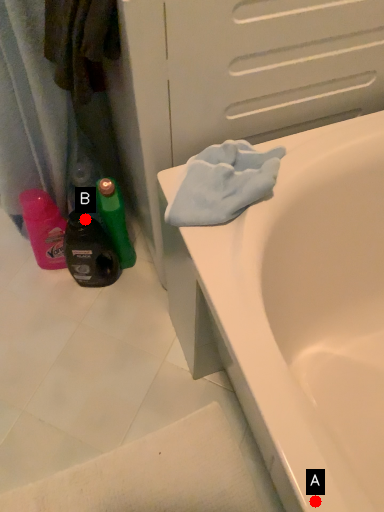
Question: Two points are circled on the image, labeled by A and B beside each circle. Which of the following is the farthest from the observer?

Choices:
 (A) A is further
 (B) B is further

Answer: (B)